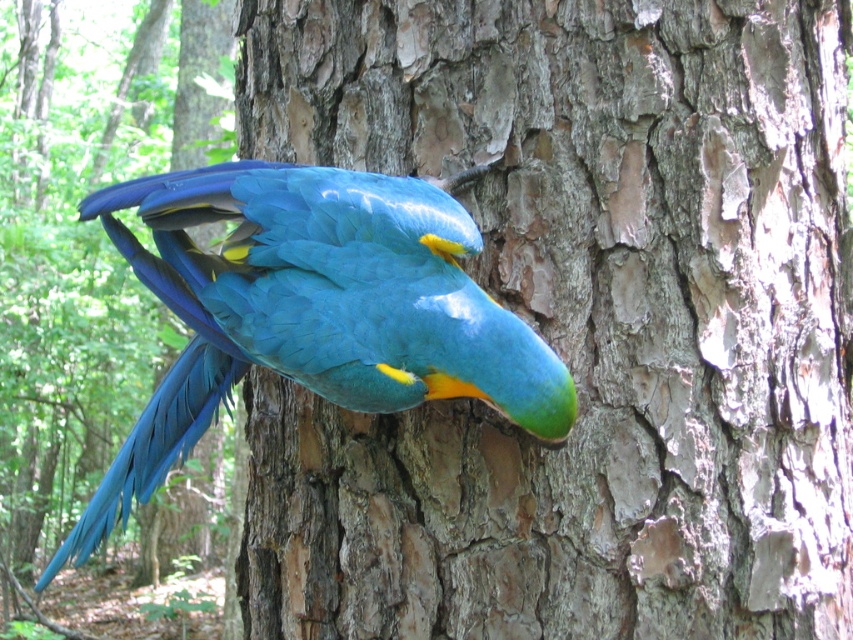
Does rough bark tree trunk at center have a larger size compared to blue glossy parrot at center?

Yes, rough bark tree trunk at center is bigger than blue glossy parrot at center.

Does rough bark tree trunk at center appear under blue glossy parrot at center?

Actually, rough bark tree trunk at center is above blue glossy parrot at center.

Identify the location of rough bark tree trunk at center. (577, 323).